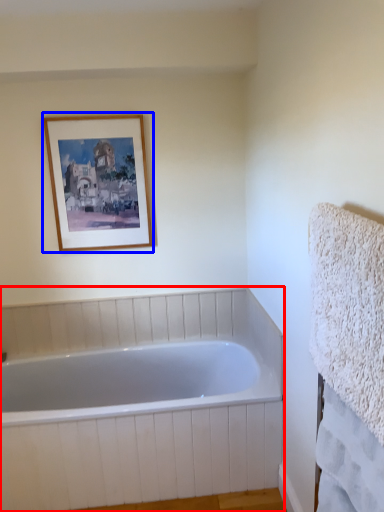
Question: Which object appears farthest to the camera in this image, bathtub (highlighted by a red box) or picture frame (highlighted by a blue box)?

Choices:
 (A) bathtub
 (B) picture frame

Answer: (B)